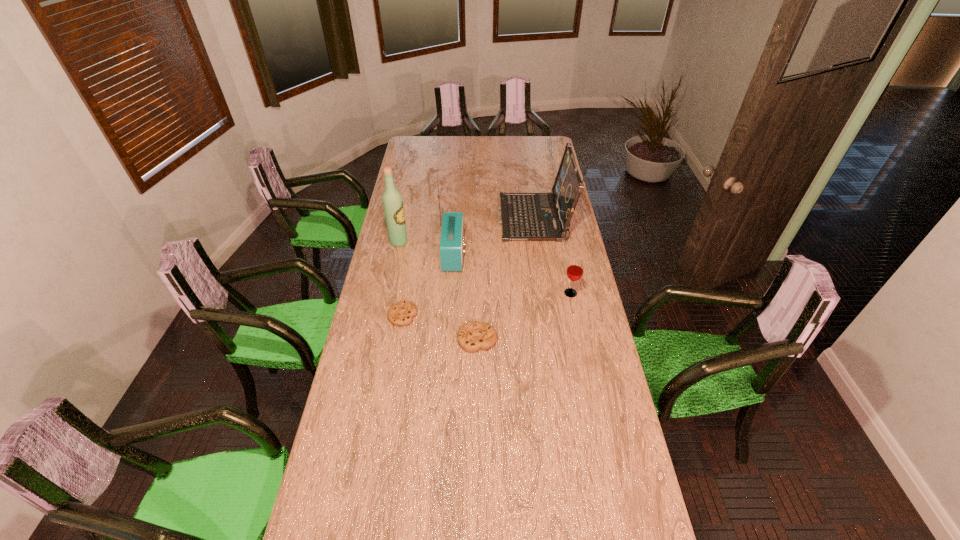
Locate an element on the screen. The width and height of the screenshot is (960, 540). vacant space that's between the shortest object and the third nearest object is located at coordinates click(x=487, y=305).

I want to click on free space between the radio receiver and the shorter cookie, so click(428, 285).

Locate an element on the screen. empty location between the right cookie and the radio receiver is located at coordinates (466, 296).

Find the location of a particular element. unoccupied position between the wine bottle and the fourth farthest object is located at coordinates (485, 268).

The width and height of the screenshot is (960, 540). Identify the location of free space that is in between the shortest object and the laptop computer. (468, 267).

You are a GUI agent. You are given a task and a screenshot of the screen. Output one action in this format:
    pyautogui.click(x=<x>, y=<y>)
    Task: Click on the free area in between the left cookie and the radio receiver
    The image size is (960, 540).
    Given the screenshot: What is the action you would take?
    pyautogui.click(x=428, y=285)

Where is `free space between the laptop computer and the taller cookie`? This screenshot has height=540, width=960. free space between the laptop computer and the taller cookie is located at coordinates (506, 279).

This screenshot has height=540, width=960. I want to click on the second closest object to the laptop computer, so click(574, 272).

Locate which object is the third closest to the left cookie. Please provide its 2D coordinates. Your answer should be formatted as a tuple, i.e. [(x, y)], where the tuple contains the x and y coordinates of a point satisfying the conditions above.

[(392, 201)]

What are the coordinates of `vacant space that satisfies the following two spatial constraints: 1. on the back side of the fourth tallest object; 2. on the front panel of the radio receiver` in the screenshot? It's located at (563, 254).